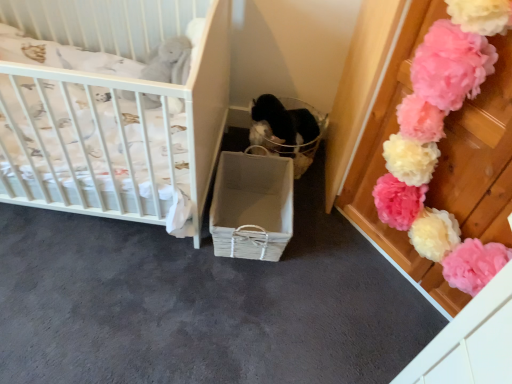
Question: Is white wicker basket at center in contact with white wicker crib at left?

Choices:
 (A) yes
 (B) no

Answer: (B)

Question: Is the position of white wicker basket at center more distant than that of white wicker crib at left?

Choices:
 (A) no
 (B) yes

Answer: (B)

Question: From the image's perspective, is white wicker basket at center on white wicker crib at left?

Choices:
 (A) no
 (B) yes

Answer: (A)

Question: Considering the relative positions of white wicker basket at center and white wicker crib at left in the image provided, is white wicker basket at center in front of white wicker crib at left?

Choices:
 (A) yes
 (B) no

Answer: (B)

Question: Considering the relative sizes of white wicker basket at center and white wicker crib at left in the image provided, is white wicker basket at center smaller than white wicker crib at left?

Choices:
 (A) no
 (B) yes

Answer: (B)

Question: Would you say pink fluffy pom-pom at upper right is to the left or to the right of translucent plastic basket at center in the picture?

Choices:
 (A) right
 (B) left

Answer: (A)

Question: From a real-world perspective, relative to translucent plastic basket at center, is pink fluffy pom-pom at upper right vertically above or below?

Choices:
 (A) below
 (B) above

Answer: (B)

Question: Is pink fluffy pom-pom at upper right bigger or smaller than translucent plastic basket at center?

Choices:
 (A) small
 (B) big

Answer: (B)

Question: In terms of height, does pink fluffy pom-pom at upper right look taller or shorter compared to translucent plastic basket at center?

Choices:
 (A) short
 (B) tall

Answer: (B)

Question: Is white wicker basket at center bigger or smaller than white wicker crib at left?

Choices:
 (A) big
 (B) small

Answer: (B)

Question: Is point [272, 155] positioned closer to the camera than point [70, 180]?

Choices:
 (A) closer
 (B) farther

Answer: (B)

Question: Choose the correct answer: Is white wicker basket at center inside white wicker crib at left or outside it?

Choices:
 (A) inside
 (B) outside

Answer: (B)

Question: Considering their positions, is white wicker basket at center located in front of or behind white wicker crib at left?

Choices:
 (A) front
 (B) behind

Answer: (B)

Question: Visually, is translucent plastic basket at center positioned to the left or to the right of white wicker crib at left?

Choices:
 (A) left
 (B) right

Answer: (B)

Question: From the image's perspective, relative to white wicker crib at left, is translucent plastic basket at center above or below?

Choices:
 (A) below
 (B) above

Answer: (A)